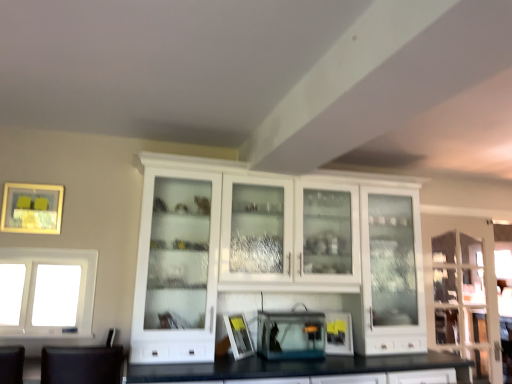
At what (x,y) coordinates should I click in order to perform the action: click on free location above white glass window at left (from a real-world perspective). Please return your answer as a coordinate pair (x, y). The image size is (512, 384). Looking at the image, I should click on (48, 252).